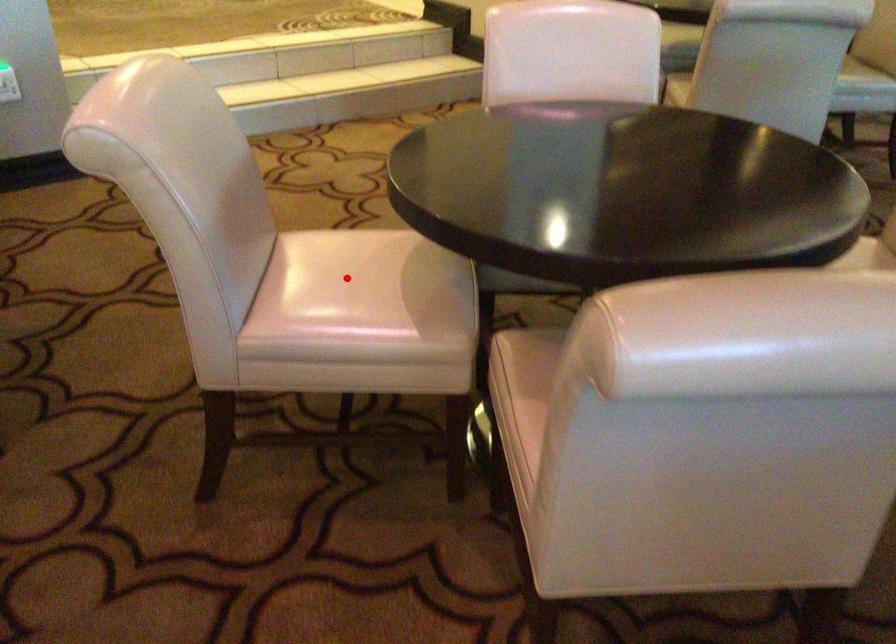
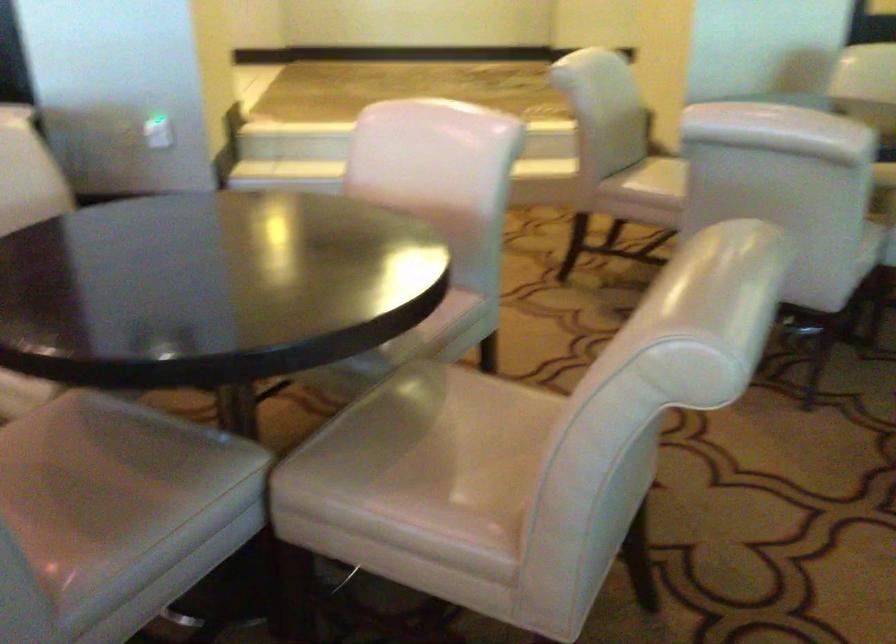
Question: I am providing you with two images of the same scene from different viewpoints. A red point is marked on the first image. At the location where the point appears in image 1, is it still visible in image 2?

Choices:
 (A) Yes
 (B) No

Answer: (B)